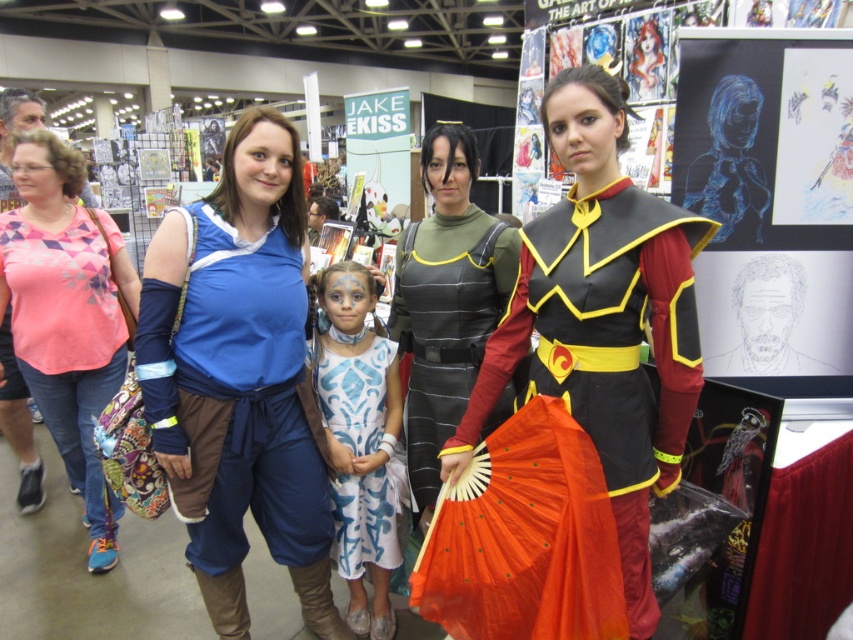
How much distance is there between matte blue shirt at center and pink printed shirt at left?

matte blue shirt at center and pink printed shirt at left are 1.11 meters apart from each other.

Who is positioned more to the right, matte blue shirt at center or pink printed shirt at left?

Positioned to the right is matte blue shirt at center.

In order to click on matte blue shirt at center in this screenshot , I will do `click(241, 378)`.

Identify the location of matte blue shirt at center. This screenshot has width=853, height=640. (241, 378).

Does point (572, 260) come in front of point (395, 321)?

That is True.

Looking at this image, can you confirm if shiny black armor at center is positioned to the left of leather-like armor at center?

In fact, shiny black armor at center is to the right of leather-like armor at center.

You are a GUI agent. You are given a task and a screenshot of the screen. Output one action in this format:
    pyautogui.click(x=<x>, y=<y>)
    Task: Click on the shiny black armor at center
    The height and width of the screenshot is (640, 853).
    Given the screenshot: What is the action you would take?
    pyautogui.click(x=602, y=321)

Does shiny black armor at center appear on the left side of white painted fabric dress at center?

No, shiny black armor at center is not to the left of white painted fabric dress at center.

Which is in front, point (662, 218) or point (393, 392)?

Point (662, 218)

Locate an element on the screen. Image resolution: width=853 pixels, height=640 pixels. shiny black armor at center is located at coordinates (602, 321).